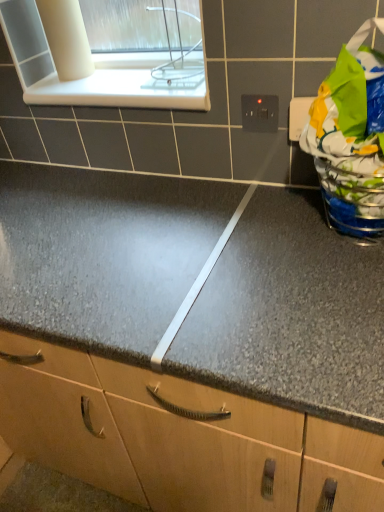
What do you see at coordinates (351, 137) in the screenshot? I see `metallic blue basket at right` at bounding box center [351, 137].

At what (x,y) coordinates should I click in order to perform the action: click on metallic blue basket at right. Please return your answer as a coordinate pair (x, y). Image resolution: width=384 pixels, height=512 pixels. Looking at the image, I should click on [351, 137].

The width and height of the screenshot is (384, 512). Identify the location of metallic blue basket at right. point(351,137).